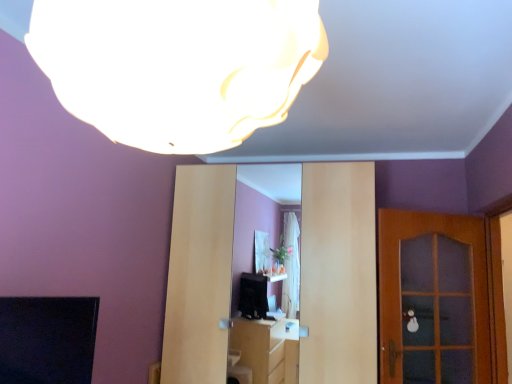
This screenshot has height=384, width=512. Describe the element at coordinates (339, 271) in the screenshot. I see `matte wood entertainment center at center` at that location.

The height and width of the screenshot is (384, 512). What are the coordinates of `matte wood entertainment center at center` in the screenshot? It's located at (339, 271).

What do you see at coordinates (433, 298) in the screenshot?
I see `wooden door at right` at bounding box center [433, 298].

I want to click on matte wood entertainment center at center, so click(339, 271).

Is matte wood entertainment center at center further to the viewer compared to wooden door at right?

No, matte wood entertainment center at center is closer to the camera.

Considering the relative positions of matte wood entertainment center at center and wooden door at right in the image provided, is matte wood entertainment center at center to the right of wooden door at right from the viewer's perspective?

In fact, matte wood entertainment center at center is to the left of wooden door at right.

Can you tell me how much matte wood entertainment center at center and wooden door at right differ in facing direction?

They differ by 32.1 degrees in their facing directions.

Considering the relative sizes of matte wood entertainment center at center and wooden door at right in the image provided, is matte wood entertainment center at center thinner than wooden door at right?

No.

From the image's perspective, between white matte lampshade at upper center and wooden door at right, who is located below?

wooden door at right appears lower in the image.

Considering the positions of objects white matte lampshade at upper center and wooden door at right in the image provided, who is behind, white matte lampshade at upper center or wooden door at right?

wooden door at right.

Who is shorter, white matte lampshade at upper center or wooden door at right?

white matte lampshade at upper center is shorter.

Is white matte lampshade at upper center not inside wooden door at right?

Absolutely, white matte lampshade at upper center is external to wooden door at right.

Based on the photo, is wooden door at right completely or partially outside of matte wood entertainment center at center?

Yes, wooden door at right is not within matte wood entertainment center at center.

Can you see wooden door at right touching matte wood entertainment center at center?

wooden door at right and matte wood entertainment center at center are not in contact.

Is wooden door at right facing towards matte wood entertainment center at center?

No, wooden door at right is not turned towards matte wood entertainment center at center.

In the scene shown: Can you confirm if wooden door at right is positioned to the right of matte wood entertainment center at center?

Correct, you'll find wooden door at right to the right of matte wood entertainment center at center.

From the image's perspective, which one is positioned lower, matte wood entertainment center at center or white matte lampshade at upper center?

matte wood entertainment center at center.

Which is correct: matte wood entertainment center at center is inside white matte lampshade at upper center, or outside of it?

matte wood entertainment center at center lies outside white matte lampshade at upper center.

Considering the points (214, 241) and (240, 2), which point is in front, point (214, 241) or point (240, 2)?

The point (240, 2) is in front.

Is white matte lampshade at upper center oriented towards matte wood entertainment center at center?

Yes, white matte lampshade at upper center is turned towards matte wood entertainment center at center.

Considering the sizes of objects white matte lampshade at upper center and matte wood entertainment center at center in the image provided, who is shorter, white matte lampshade at upper center or matte wood entertainment center at center?

white matte lampshade at upper center is shorter.

Is white matte lampshade at upper center spatially inside matte wood entertainment center at center, or outside of it?

white matte lampshade at upper center is outside matte wood entertainment center at center.

Looking at this image, from a real-world perspective, is wooden door at right on white matte lampshade at upper center?

No, from a real-world perspective, wooden door at right is not over white matte lampshade at upper center

Is wooden door at right taller or shorter than white matte lampshade at upper center?

Clearly, wooden door at right is taller compared to white matte lampshade at upper center.

Which is more to the left, wooden door at right or white matte lampshade at upper center?

white matte lampshade at upper center.

I want to click on door behind the matte wood entertainment center at center, so click(x=433, y=298).

Where is `door below the white matte lampshade at upper center (from a real-world perspective)`? The height and width of the screenshot is (384, 512). door below the white matte lampshade at upper center (from a real-world perspective) is located at coordinates (433, 298).

Which object lies further to the anchor point white matte lampshade at upper center, wooden door at right or matte wood entertainment center at center?

The object further to white matte lampshade at upper center is wooden door at right.

Considering their positions, is matte wood entertainment center at center positioned further to white matte lampshade at upper center than wooden door at right?

wooden door at right.

Which object lies nearer to the anchor point matte wood entertainment center at center, white matte lampshade at upper center or wooden door at right?

wooden door at right is closer to matte wood entertainment center at center.

Estimate the real-world distances between objects in this image. Which object is further from wooden door at right, matte wood entertainment center at center or white matte lampshade at upper center?

The object further to wooden door at right is white matte lampshade at upper center.

Looking at this image, which object lies nearer to the anchor point wooden door at right, white matte lampshade at upper center or matte wood entertainment center at center?

A: matte wood entertainment center at center lies closer to wooden door at right than the other object.

Consider the image. Looking at the image, which one is located further to matte wood entertainment center at center, wooden door at right or white matte lampshade at upper center?

white matte lampshade at upper center is further to matte wood entertainment center at center.

You are a GUI agent. You are given a task and a screenshot of the screen. Output one action in this format:
    pyautogui.click(x=<x>, y=<y>)
    Task: Click on the entertainment center between white matte lampshade at upper center and wooden door at right from front to back
    
    Given the screenshot: What is the action you would take?
    pyautogui.click(x=339, y=271)